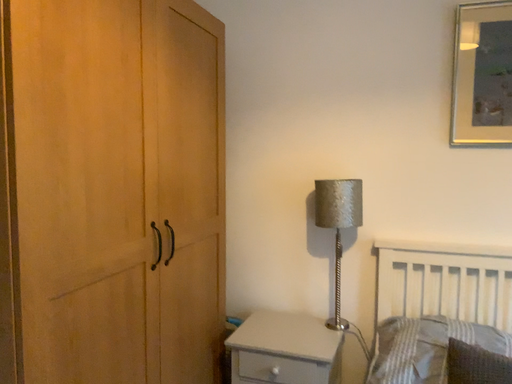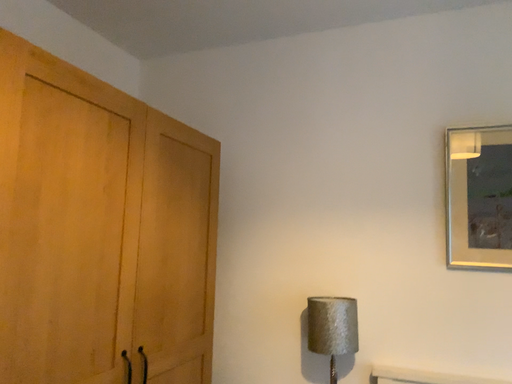
Question: Which way did the camera rotate in the video?

Choices:
 (A) rotated upward
 (B) rotated downward

Answer: (A)